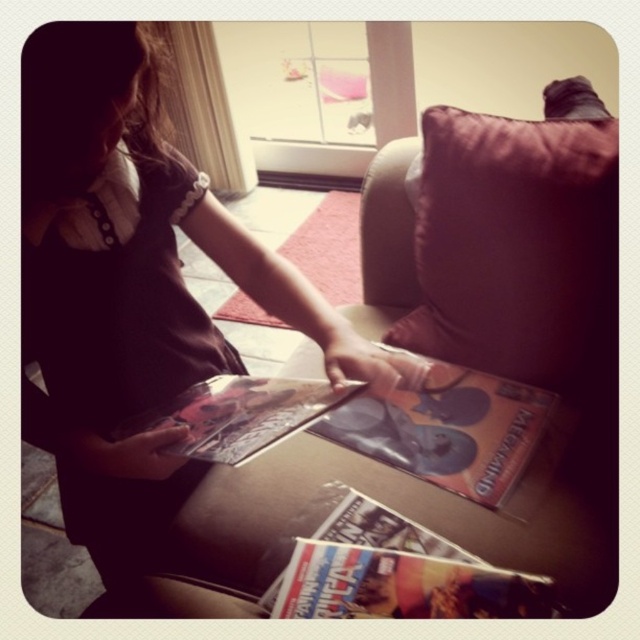
Which is in front, point (20, 406) or point (448, 115)?

Point (20, 406)

Can you confirm if matte brown dress at center is positioned to the right of suede-like beige couch at center?

In fact, matte brown dress at center is to the left of suede-like beige couch at center.

Where is `matte brown dress at center`? The image size is (640, 640). matte brown dress at center is located at coordinates (131, 298).

Can you confirm if matte cardboard magazine at center is wider than matte paper comic book at lower center?

Correct, the width of matte cardboard magazine at center exceeds that of matte paper comic book at lower center.

Is point (372, 440) more distant than point (320, 529)?

Yes, point (372, 440) is farther from viewer.

Locate an element on the screen. This screenshot has height=640, width=640. matte cardboard magazine at center is located at coordinates (456, 435).

Is matte brown dress at center taller than matte cardboard magazine at center?

Indeed, matte brown dress at center has a greater height compared to matte cardboard magazine at center.

Between point (74, 340) and point (378, 428), which one is positioned in front?

Point (74, 340) is more forward.

Identify the location of matte brown dress at center. Image resolution: width=640 pixels, height=640 pixels. (131, 298).